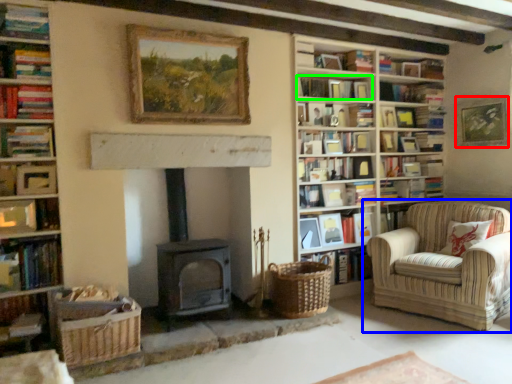
Question: Which object is positioned farthest from picture frame (highlighted by a red box)? Select from chair (highlighted by a blue box) and book (highlighted by a green box).

Choices:
 (A) chair
 (B) book

Answer: (B)